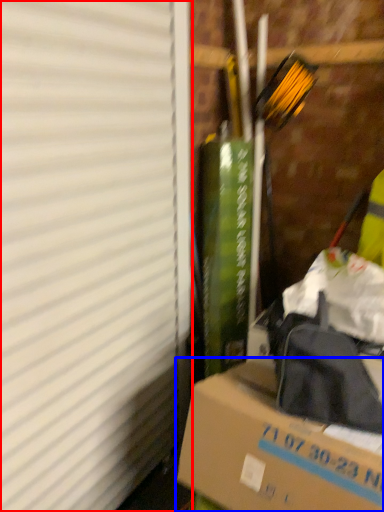
Question: Which of the following is the closest to the observer, window screen (highlighted by a red box) or box (highlighted by a blue box)?

Choices:
 (A) window screen
 (B) box

Answer: (A)